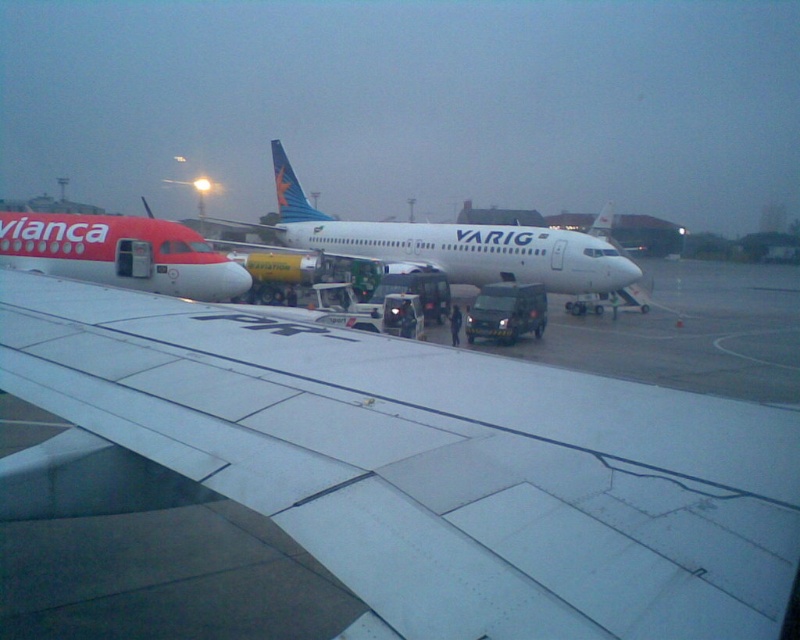
You are a pilot standing at the point with coordinates (436, 465) in the airport scene. What object are you facing?

The point at coordinates (436, 465) indicates the white matte wing at center, so you are facing the white matte wing at center.

You are standing at the airport and want to take a photo of the two points marked in the scene. Which point, point (x=625, y=445) or point (x=168, y=230), will appear larger in your photo?

Point (x=625, y=445) will appear larger in the photo because it is closer to the viewer than point (x=168, y=230).